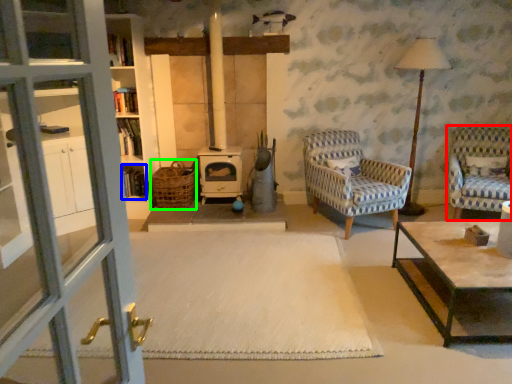
Question: Which object is the farthest from chair (highlighted by a red box)? Choose among these: shelf (highlighted by a blue box) or basket (highlighted by a green box).

Choices:
 (A) shelf
 (B) basket

Answer: (A)